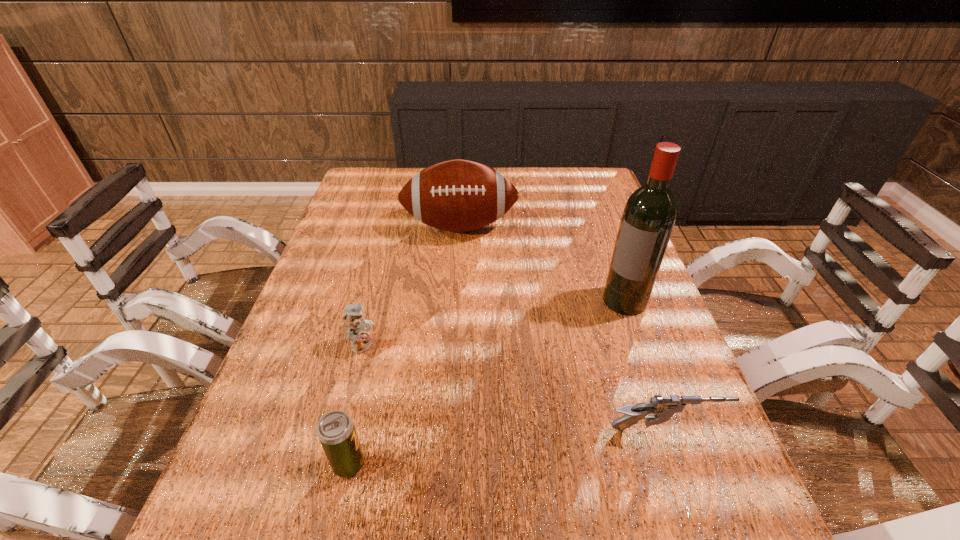
The height and width of the screenshot is (540, 960). I want to click on unoccupied position between the gun and the nearest object, so click(x=507, y=447).

This screenshot has width=960, height=540. In order to click on free space between the second tallest object and the fourth nearest object in this screenshot , I will do point(542,264).

Where is `empty space between the football and the gun`? Image resolution: width=960 pixels, height=540 pixels. empty space between the football and the gun is located at coordinates (562, 328).

At what (x,y) coordinates should I click in order to perform the action: click on unoccupied area between the second tallest object and the fourth nearest object. Please return your answer as a coordinate pair (x, y). The width and height of the screenshot is (960, 540). Looking at the image, I should click on (542, 264).

You are a GUI agent. You are given a task and a screenshot of the screen. Output one action in this format:
    pyautogui.click(x=<x>, y=<y>)
    Task: Click on the free space between the beer can and the second tallest object
    
    Given the screenshot: What is the action you would take?
    pyautogui.click(x=404, y=345)

At what (x,y) coordinates should I click in order to perform the action: click on vacant space that is in between the tallest object and the fourth farthest object. Please return your answer as a coordinate pair (x, y). Image resolution: width=960 pixels, height=540 pixels. Looking at the image, I should click on (644, 365).

Find the location of a particular element. free area in between the fourth farthest object and the beer can is located at coordinates (507, 447).

Locate which object ranks fourth in proximity to the farthest object. Please provide its 2D coordinates. Your answer should be formatted as a tuple, i.e. [(x, y)], where the tuple contains the x and y coordinates of a point satisfying the conditions above.

[(336, 431)]

Identify the location of object that can be found as the second closest to the gun. This screenshot has width=960, height=540. (336, 431).

This screenshot has width=960, height=540. I want to click on vacant space that satisfies the following two spatial constraints: 1. on the front side of the gun; 2. at the barrel of the third nearest object, so click(x=341, y=430).